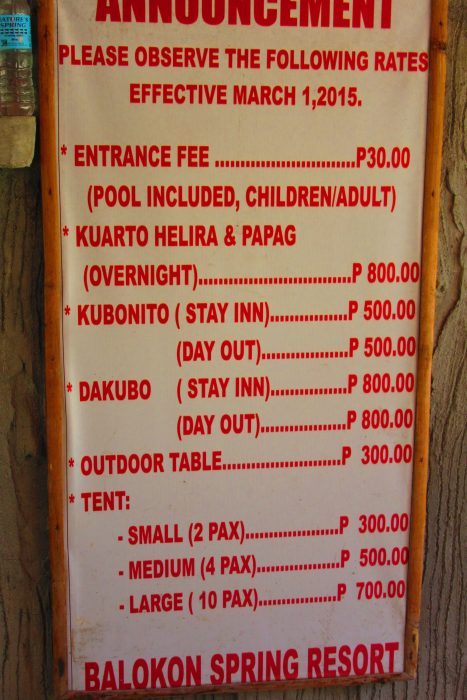
At what (x,y) coordinates should I click in order to perform the action: click on light brown frame. Please return your answer as a coordinate pair (x, y). This screenshot has width=467, height=700. Looking at the image, I should click on (438, 92), (51, 372).